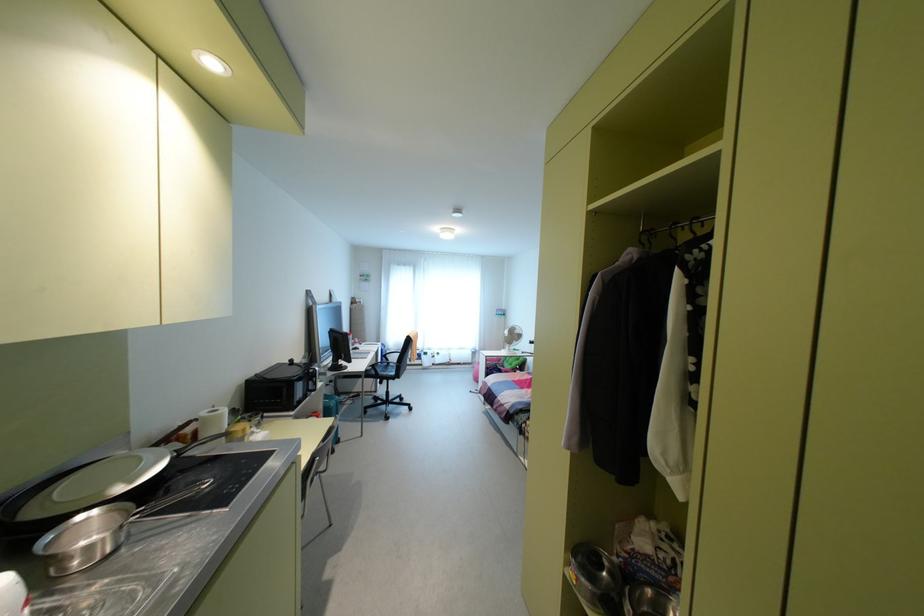
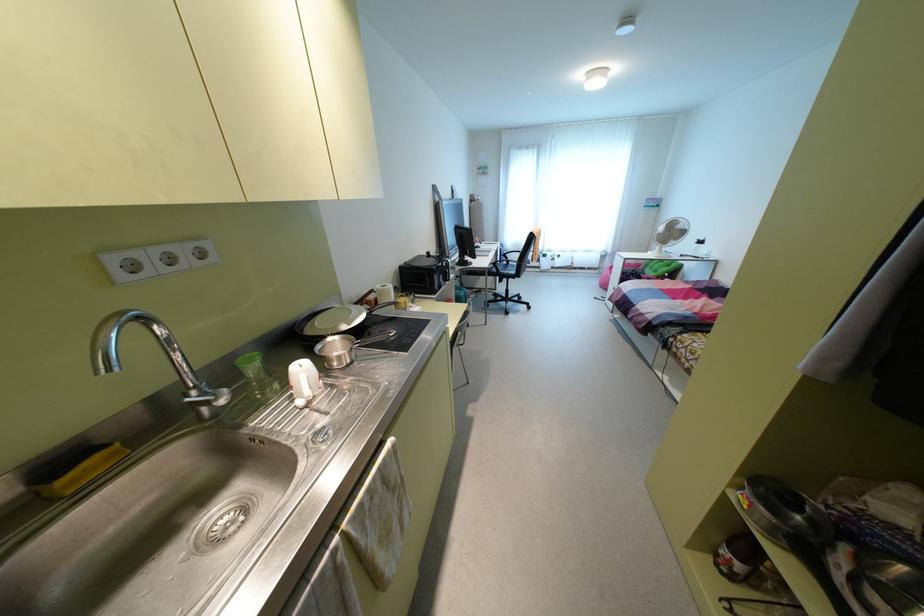
Where in the second image is the point corresponding to (x=516, y=331) from the first image?

(679, 225)